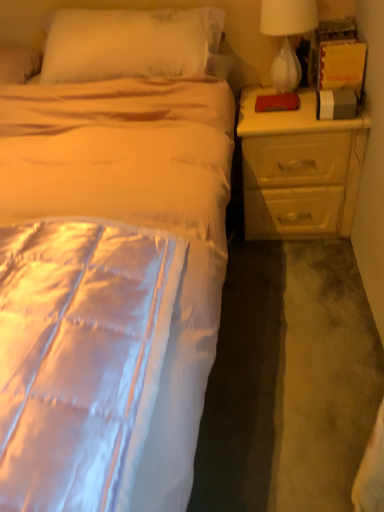
Question: Can you confirm if silky white bed at center is positioned to the left of white glass lamp at upper right?

Choices:
 (A) yes
 (B) no

Answer: (A)

Question: Is silky white bed at center wider than white glass lamp at upper right?

Choices:
 (A) yes
 (B) no

Answer: (A)

Question: Is white glass lamp at upper right a part of silky white bed at center?

Choices:
 (A) no
 (B) yes

Answer: (B)

Question: Is silky white bed at center not close to white glass lamp at upper right?

Choices:
 (A) no
 (B) yes

Answer: (A)

Question: From a real-world perspective, is silky white bed at center beneath white glass lamp at upper right?

Choices:
 (A) yes
 (B) no

Answer: (A)

Question: Considering the positions of silky white bed at center and white glass lamp at upper right in the image, is silky white bed at center taller or shorter than white glass lamp at upper right?

Choices:
 (A) short
 (B) tall

Answer: (B)

Question: Based on their sizes in the image, would you say silky white bed at center is bigger or smaller than white glass lamp at upper right?

Choices:
 (A) big
 (B) small

Answer: (A)

Question: From a real-world perspective, is silky white bed at center physically located above or below white glass lamp at upper right?

Choices:
 (A) below
 (B) above

Answer: (A)

Question: Is silky white bed at center in front of or behind white glass lamp at upper right in the image?

Choices:
 (A) behind
 (B) front

Answer: (B)

Question: Is yellow matte nightstand at right to the left or to the right of silky white bed at center in the image?

Choices:
 (A) right
 (B) left

Answer: (A)

Question: Is yellow matte nightstand at right taller or shorter than silky white bed at center?

Choices:
 (A) tall
 (B) short

Answer: (B)

Question: Is yellow matte nightstand at right spatially inside silky white bed at center, or outside of it?

Choices:
 (A) outside
 (B) inside

Answer: (B)

Question: Is point (334, 130) positioned closer to the camera than point (18, 346)?

Choices:
 (A) farther
 (B) closer

Answer: (A)

Question: Is white glass lamp at upper right in front of or behind silky white bed at center in the image?

Choices:
 (A) front
 (B) behind

Answer: (B)

Question: Considering the positions of white glass lamp at upper right and silky white bed at center in the image, is white glass lamp at upper right wider or thinner than silky white bed at center?

Choices:
 (A) thin
 (B) wide

Answer: (A)